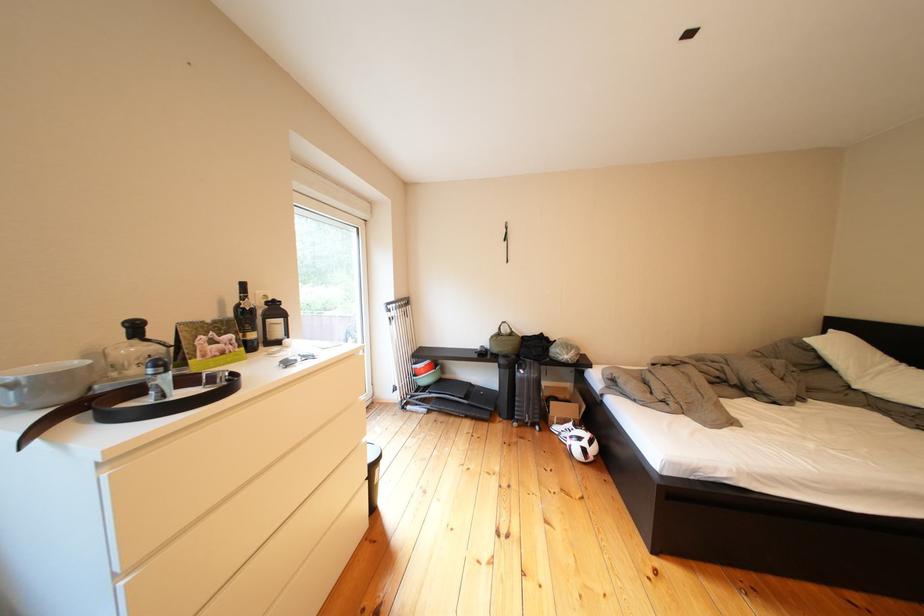
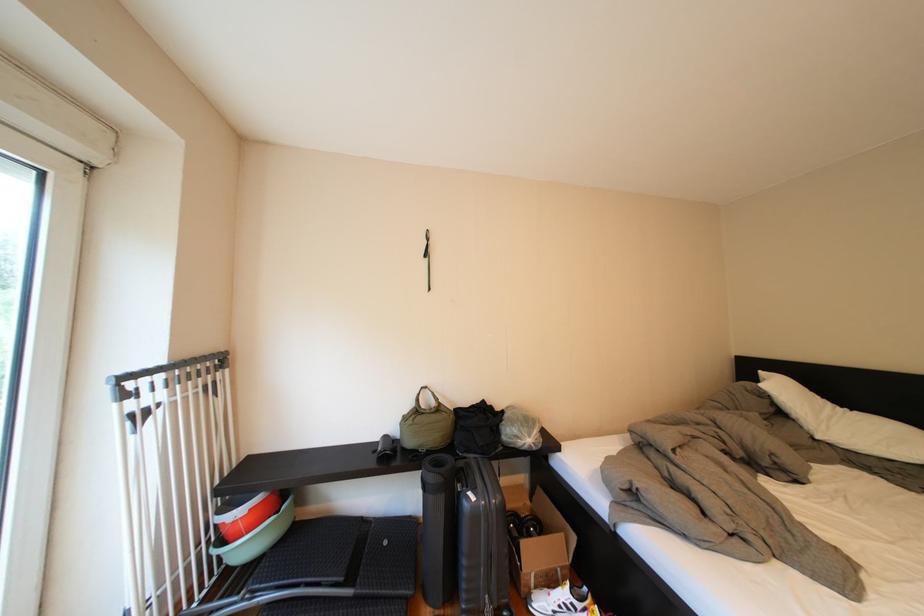
The point at [439,384] is marked in the first image. Where is the corresponding point in the second image?

(261, 551)